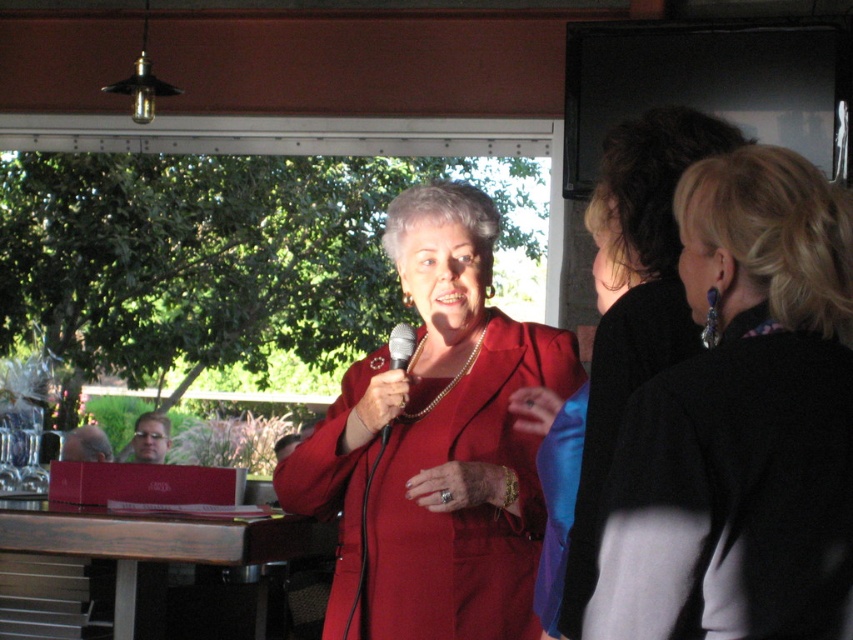
Can you confirm if black fabric jacket at upper right is positioned above metallic silver microphone at center?

Yes.

Who is positioned more to the left, black fabric jacket at upper right or metallic silver microphone at center?

metallic silver microphone at center

Is point (848, 308) in front of point (383, 440)?

That is True.

Where is `black fabric jacket at upper right`? black fabric jacket at upper right is located at coordinates (741, 424).

Is point (698, 243) positioned behind point (633, 216)?

No, (698, 243) is closer to viewer.

Between black fabric jacket at upper right and matte red blazer at center, which one is positioned lower?

Positioned lower is black fabric jacket at upper right.

Find the location of a particular element. The height and width of the screenshot is (640, 853). black fabric jacket at upper right is located at coordinates (741, 424).

Is point (793, 172) positioned after point (370, 413)?

That is False.

Who is shorter, black fabric jacket at upper right or matte red suit at center?

black fabric jacket at upper right

This screenshot has height=640, width=853. Describe the element at coordinates (741, 424) in the screenshot. I see `black fabric jacket at upper right` at that location.

The width and height of the screenshot is (853, 640). I want to click on black fabric jacket at upper right, so click(x=741, y=424).